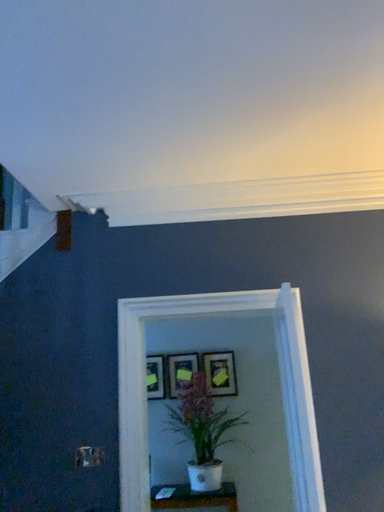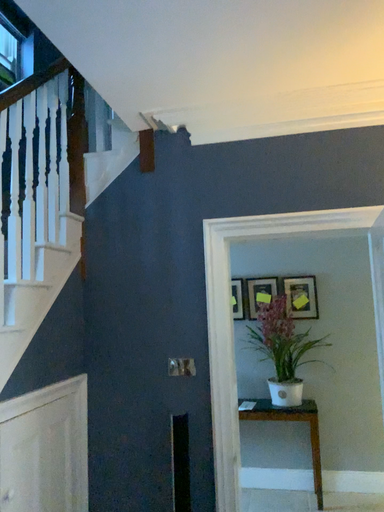
Question: How did the camera likely rotate when shooting the video?

Choices:
 (A) rotated downward
 (B) rotated upward

Answer: (A)